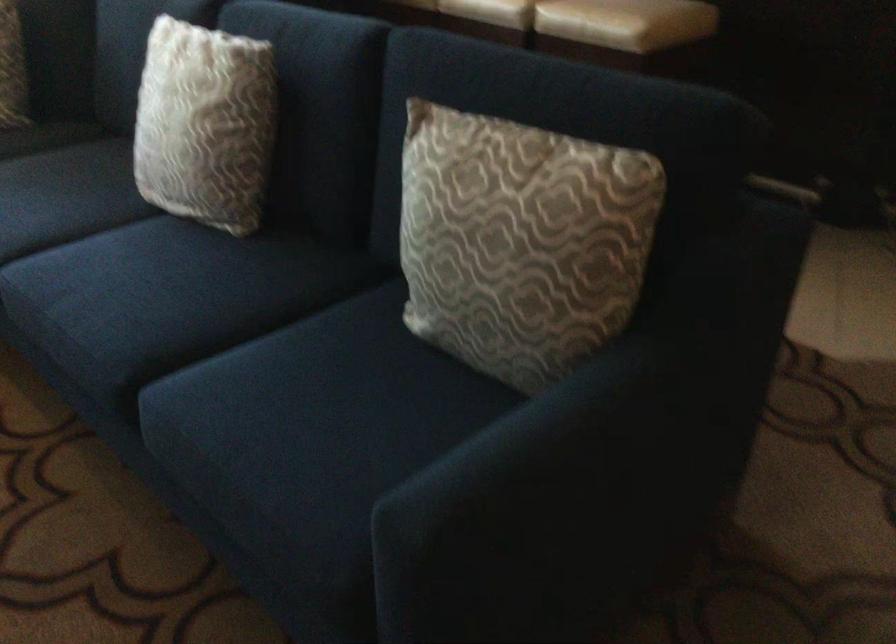
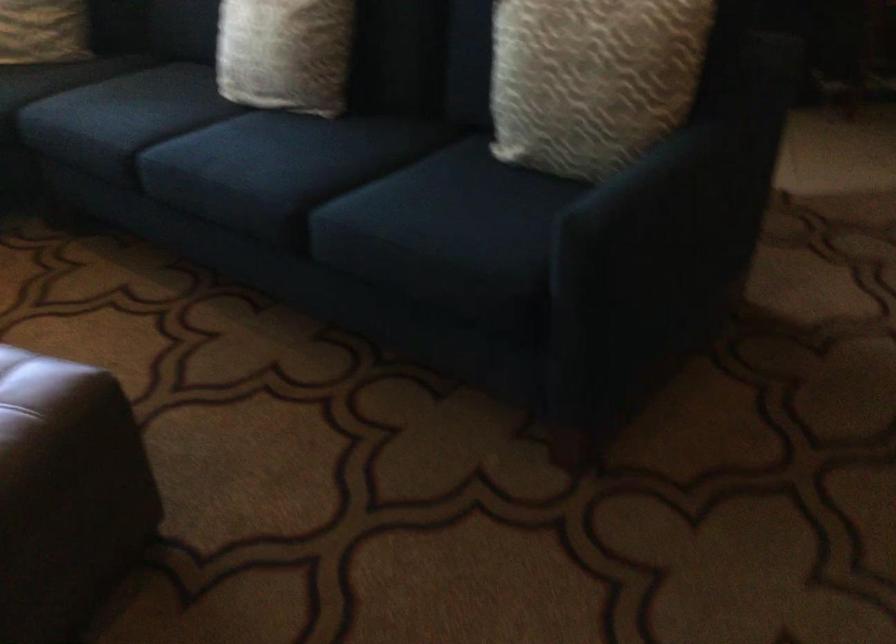
In the second image, find the point that corresponds to pixel 193 163 in the first image.

(285, 53)